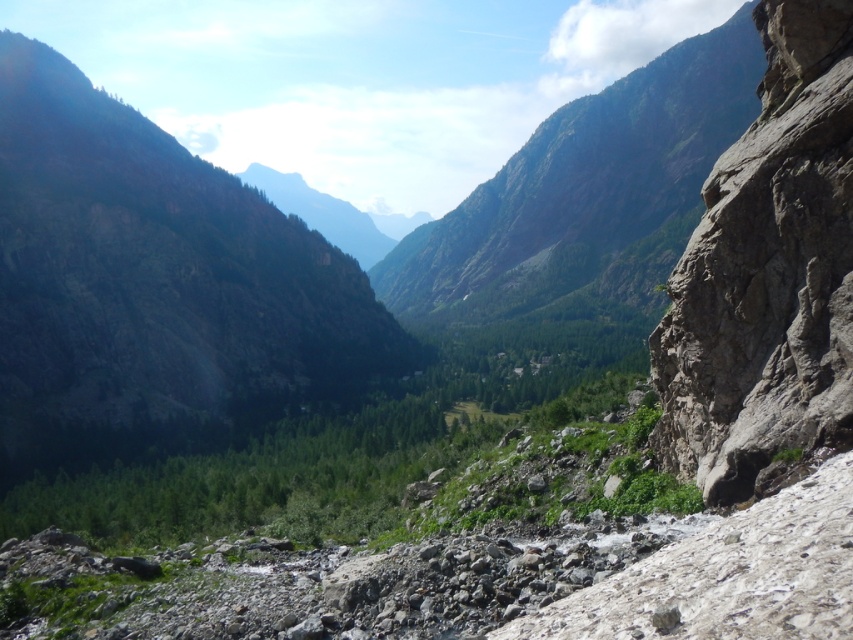
Is the position of green rocky mountain at upper left more distant than that of green rock mountain at center?

No, it is in front of green rock mountain at center.

Find the location of a particular element. The width and height of the screenshot is (853, 640). green rocky mountain at upper left is located at coordinates (155, 288).

You are a GUI agent. You are given a task and a screenshot of the screen. Output one action in this format:
    pyautogui.click(x=<x>, y=<y>)
    Task: Click on the green rocky mountain at upper left
    Image resolution: width=853 pixels, height=640 pixels.
    Given the screenshot: What is the action you would take?
    pyautogui.click(x=155, y=288)